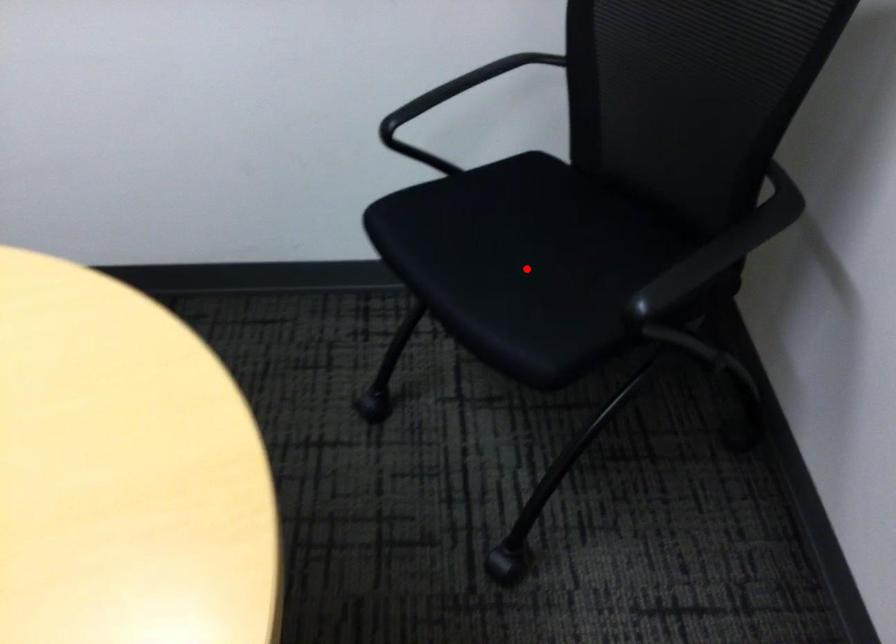
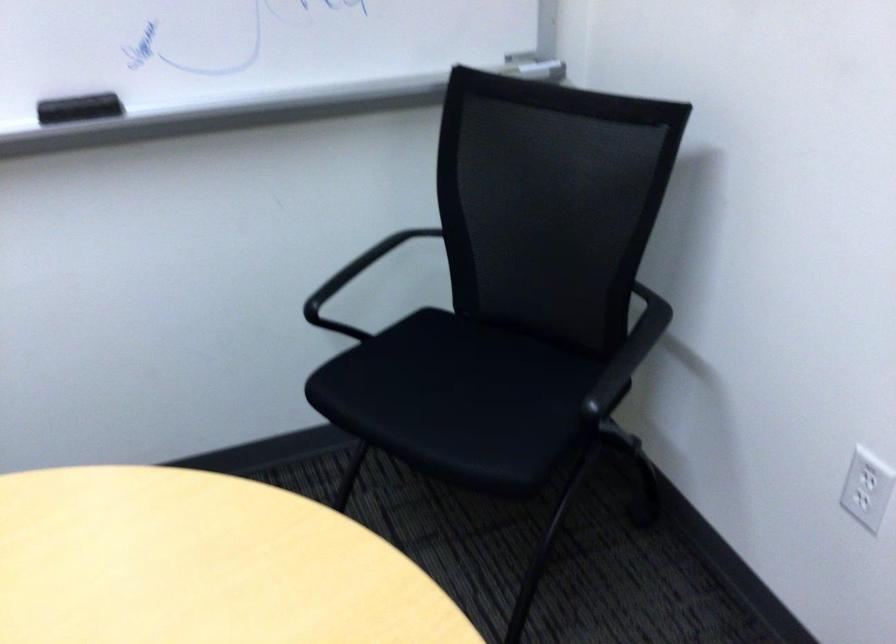
Locate, in the second image, the point that corresponds to the highlighted location in the first image.

(460, 401)